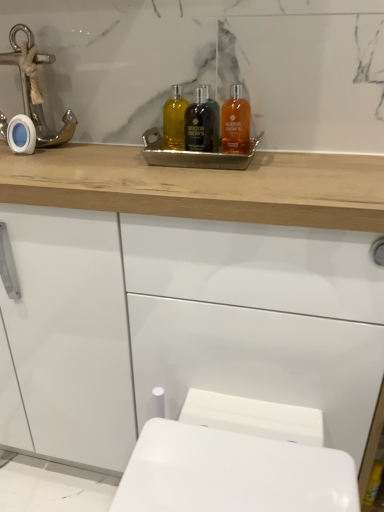
Identify the location of vacant area that is situated to the right of metallic anchor at left. (110, 145).